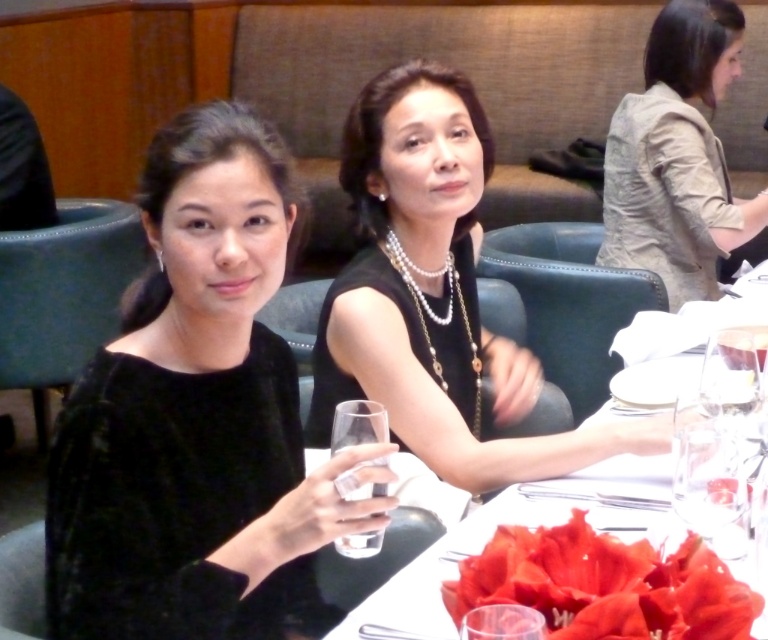
You are a photographer standing at the back of the room. You want to take a photo of the black velvet dress at center from a distance that is exactly 4.59 feet away. Is your current position suitable for capturing the dress at the required distance?

The black velvet dress at center is already positioned 4.59 feet away from the camera, so your current position is suitable for capturing the dress at the required distance.

You are a photographer at the event and want to ensure both the velvet black dress at center and the glassy clear water at center are clearly visible in your photo. Given their sizes, which object should you focus on first to ensure proper framing?

Since the velvet black dress at center occupies less space than the glassy clear water at center, you should focus on the velvet black dress at center first. This ensures that the smaller object is properly framed before adjusting for the larger glassy clear water at center.